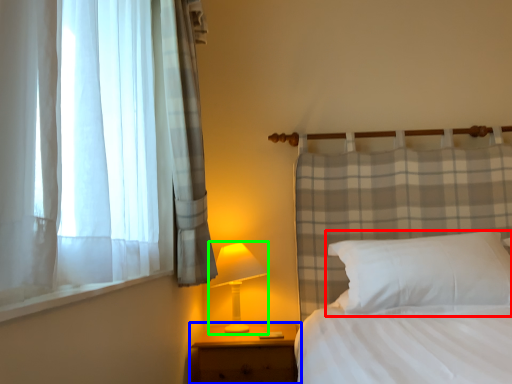
Question: Estimate the real-world distances between objects in this image. Which object is farther from pillow (highlighted by a red box), nightstand (highlighted by a blue box) or table lamp (highlighted by a green box)?

Choices:
 (A) nightstand
 (B) table lamp

Answer: (B)